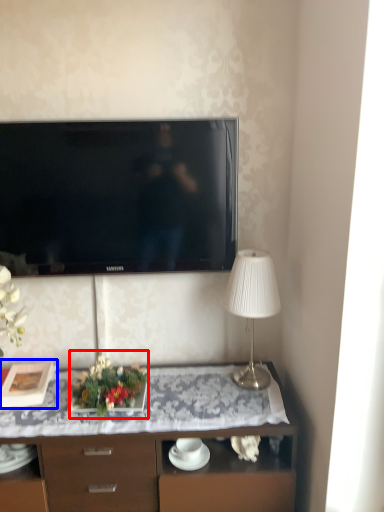
Question: Which object appears farthest to the camera in this image, floral arrangement (highlighted by a red box) or picture frame (highlighted by a blue box)?

Choices:
 (A) floral arrangement
 (B) picture frame

Answer: (B)